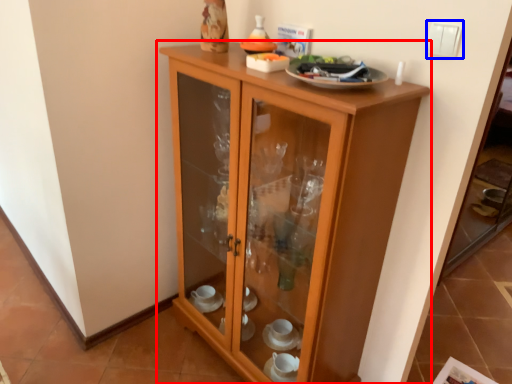
Question: Which object appears closest to the camera in this image, cupboard (highlighted by a red box) or light switch (highlighted by a blue box)?

Choices:
 (A) cupboard
 (B) light switch

Answer: (A)